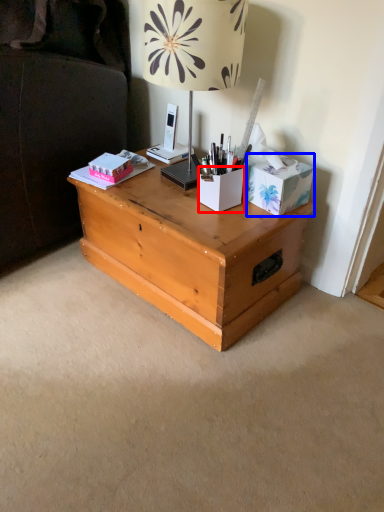
Question: Which object is further to the camera taking this photo, cardboard box (highlighted by a red box) or cardboard box (highlighted by a blue box)?

Choices:
 (A) cardboard box
 (B) cardboard box

Answer: (A)